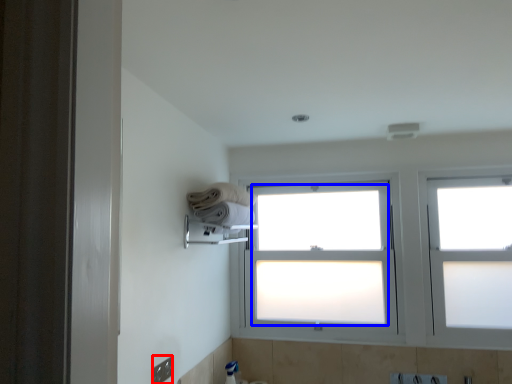
Question: Which object appears closest to the camera in this image, electric outlet (highlighted by a red box) or bay window (highlighted by a blue box)?

Choices:
 (A) electric outlet
 (B) bay window

Answer: (A)